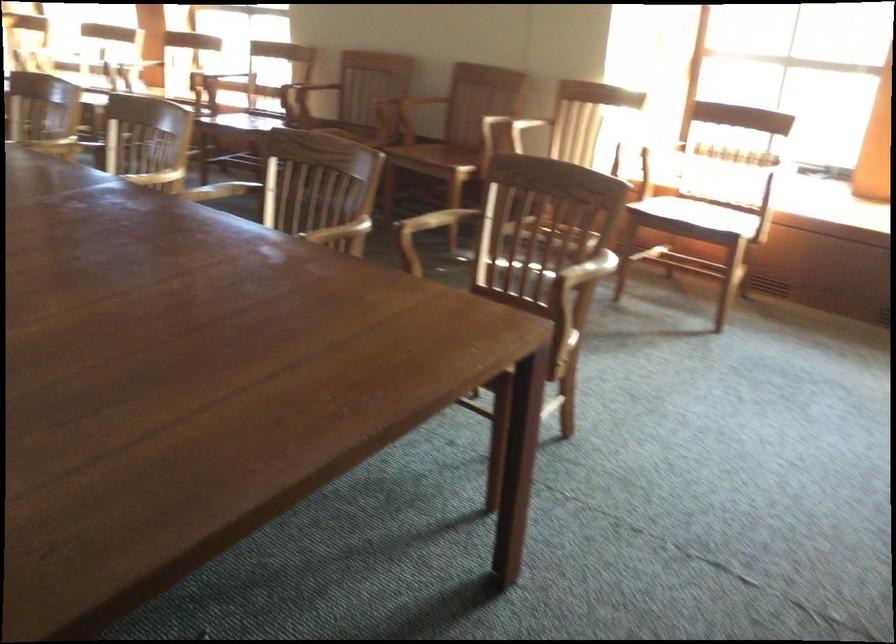
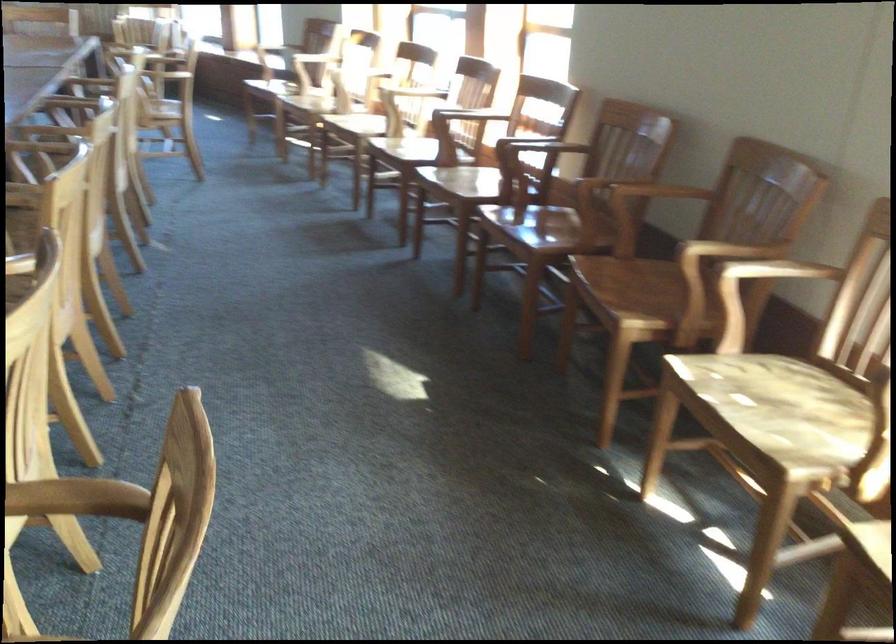
In the second image, find the point that corresponds to the point at 538,111 in the first image.

(776, 270)